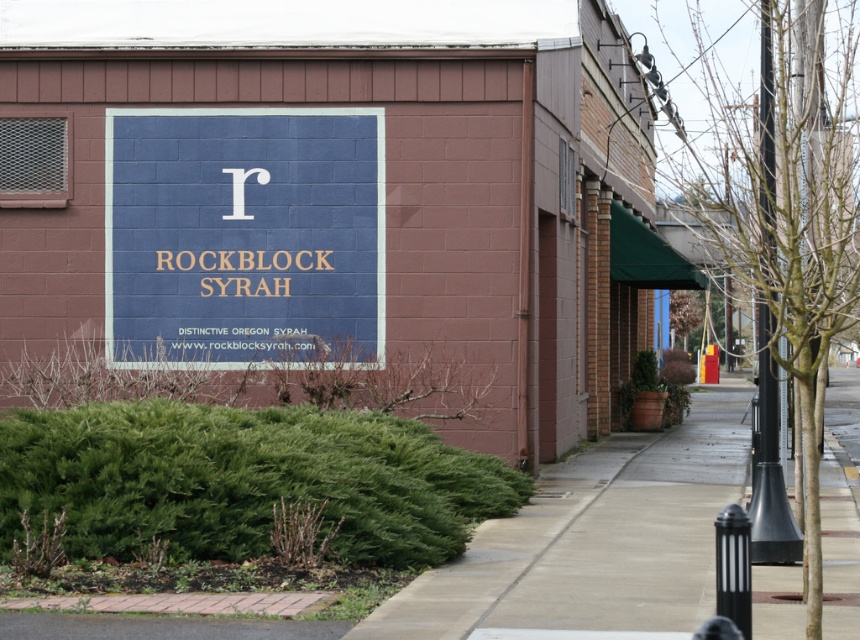
Question: Is green leafy bush at lower center above concrete sidewalk at center?

Choices:
 (A) yes
 (B) no

Answer: (A)

Question: Which of the following is the closest to the observer?

Choices:
 (A) green leafy bush at lower center
 (B) blue painted sign at center
 (C) concrete sidewalk at center

Answer: (C)

Question: Does green leafy bush at lower center have a larger size compared to concrete sidewalk at center?

Choices:
 (A) no
 (B) yes

Answer: (A)

Question: Which of the following is the closest to the observer?

Choices:
 (A) green leafy bush at lower center
 (B) blue painted sign at center
 (C) concrete sidewalk at center

Answer: (C)

Question: Observing the image, what is the correct spatial positioning of blue painted sign at center in reference to concrete sidewalk at center?

Choices:
 (A) below
 (B) above

Answer: (B)

Question: Which point is closer to the camera taking this photo?

Choices:
 (A) (54, 419)
 (B) (134, 232)
 (C) (480, 524)

Answer: (A)